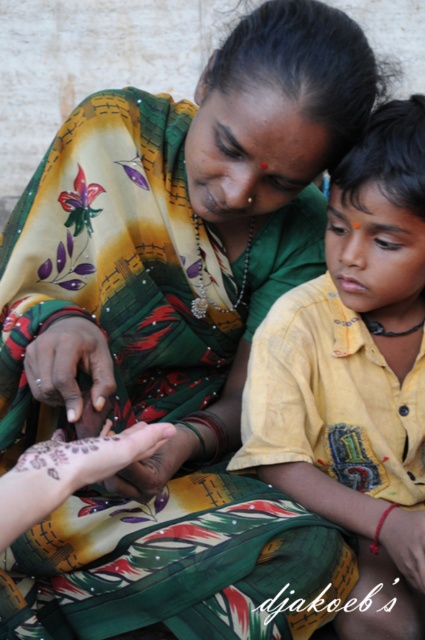
Question: Is dark skin hand at center positioned before matte skin at center?

Choices:
 (A) yes
 (B) no

Answer: (A)

Question: Does yellow cotton shirt at center appear on the right side of smooth skin hand at center?

Choices:
 (A) no
 (B) yes

Answer: (A)

Question: Does yellow cotton shirt at center have a smaller size compared to matte skin at center?

Choices:
 (A) yes
 (B) no

Answer: (B)

Question: Which of the following is the closest to the observer?

Choices:
 (A) dark skin hand at center
 (B) smooth skin hand at center
 (C) matte skin at center

Answer: (A)

Question: Which point is farther to the camera?

Choices:
 (A) (62, 380)
 (B) (402, 548)

Answer: (B)

Question: Which point is farther from the camera taking this photo?

Choices:
 (A) (178, 468)
 (B) (112, 392)
 (C) (314, 358)
 (D) (405, 541)

Answer: (C)